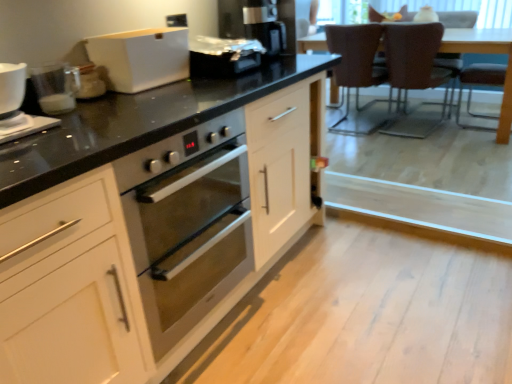
Question: Can you confirm if brown leather chair at upper right, acting as the 1th chair starting from the right, is positioned to the right of satin black toaster at upper center, acting as the 1th appliance starting from the right?

Choices:
 (A) no
 (B) yes

Answer: (B)

Question: Considering the relative positions of brown leather chair at upper right, acting as the 1th chair starting from the right, and satin black toaster at upper center, which is the 3th appliance in front-to-back order, in the image provided, is brown leather chair at upper right, acting as the 1th chair starting from the right, to the left of satin black toaster at upper center, which is the 3th appliance in front-to-back order, from the viewer's perspective?

Choices:
 (A) no
 (B) yes

Answer: (A)

Question: Is satin black toaster at upper center, the 3th appliance in the bottom-to-top sequence, at the back of brown leather chair at upper right, acting as the 1th chair starting from the right?

Choices:
 (A) no
 (B) yes

Answer: (B)

Question: Considering the relative sizes of brown leather chair at upper right, which is the second chair in left-to-right order, and satin black toaster at upper center, which appears as the first appliance when viewed from the top, in the image provided, is brown leather chair at upper right, which is the second chair in left-to-right order, wider than satin black toaster at upper center, which appears as the first appliance when viewed from the top,?

Choices:
 (A) no
 (B) yes

Answer: (B)

Question: Is brown leather chair at upper right, acting as the 1th chair starting from the right, taller than satin black toaster at upper center, the 3th appliance in the bottom-to-top sequence?

Choices:
 (A) yes
 (B) no

Answer: (A)

Question: From the image's perspective, does brown leather chair at upper right, acting as the 1th chair starting from the right, appear higher than satin black toaster at upper center, the 3th appliance in the bottom-to-top sequence?

Choices:
 (A) yes
 (B) no

Answer: (A)

Question: Is brown leather chair at upper right, which is the second chair in left-to-right order, positioned behind white matte bread bin at upper center?

Choices:
 (A) no
 (B) yes

Answer: (B)

Question: Is white matte bread bin at upper center a part of brown leather chair at upper right, which is the second chair in left-to-right order?

Choices:
 (A) yes
 (B) no

Answer: (B)

Question: Can you confirm if brown leather chair at upper right, which is the second chair in left-to-right order, is thinner than white matte bread bin at upper center?

Choices:
 (A) yes
 (B) no

Answer: (B)

Question: Considering the relative positions of brown leather chair at upper right, which is the second chair in left-to-right order, and white matte bread bin at upper center in the image provided, is brown leather chair at upper right, which is the second chair in left-to-right order, to the left of white matte bread bin at upper center from the viewer's perspective?

Choices:
 (A) yes
 (B) no

Answer: (B)

Question: Does brown leather chair at upper right, which is the second chair in left-to-right order, have a greater height compared to white matte bread bin at upper center?

Choices:
 (A) no
 (B) yes

Answer: (B)

Question: From the image's perspective, is brown leather chair at upper right, which is the second chair in left-to-right order, beneath white matte bread bin at upper center?

Choices:
 (A) yes
 (B) no

Answer: (B)

Question: From the image's perspective, is brown leather armchair at right, placed as the 1th armchair when sorted from front to back, over brown leather armchair at upper right, which is counted as the second armchair, starting from the front?

Choices:
 (A) no
 (B) yes

Answer: (A)